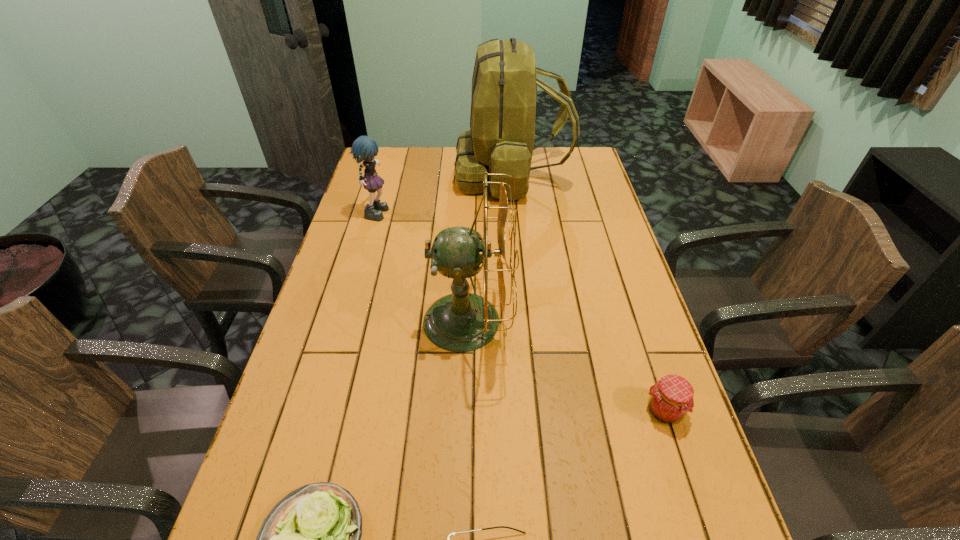
You are a GUI agent. You are given a task and a screenshot of the screen. Output one action in this format:
    pyautogui.click(x=<x>, y=<y>)
    Task: Click on the vacant space at the far right corner of the desktop
    The image size is (960, 540).
    Given the screenshot: What is the action you would take?
    pyautogui.click(x=571, y=155)

Find the location of a particular element. This screenshot has width=960, height=540. vacant space that is in between the third tallest object and the third shortest object is located at coordinates (521, 310).

You are a GUI agent. You are given a task and a screenshot of the screen. Output one action in this format:
    pyautogui.click(x=<x>, y=<y>)
    Task: Click on the vacant area that lies between the rag doll and the backpack
    The width and height of the screenshot is (960, 540).
    Given the screenshot: What is the action you would take?
    [444, 192]

The width and height of the screenshot is (960, 540). I want to click on unoccupied area between the fan and the rag doll, so click(x=421, y=266).

Identify the location of vacant point located between the backpack and the rag doll. Image resolution: width=960 pixels, height=540 pixels. (444, 192).

Identify the location of the closest object to the fourth shortest object. The width and height of the screenshot is (960, 540). (501, 138).

This screenshot has height=540, width=960. Identify the location of object that stands as the fifth closest to the third farthest object. (501, 138).

This screenshot has height=540, width=960. I want to click on vacant region that satisfies the following two spatial constraints: 1. on the front-facing side of the third nearest object; 2. on the left side of the backpack, so click(x=534, y=411).

Image resolution: width=960 pixels, height=540 pixels. In order to click on free space in the image that satisfies the following two spatial constraints: 1. on the front-facing side of the jam; 2. on the right side of the backpack in this screenshot , I will do `click(534, 411)`.

Image resolution: width=960 pixels, height=540 pixels. In order to click on free point that satisfies the following two spatial constraints: 1. on the front-facing side of the fourth shortest object; 2. on the right side of the third shortest object in this screenshot , I will do (x=321, y=411).